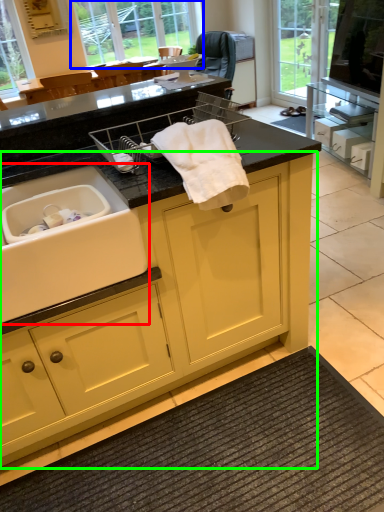
Question: Considering the real-world distances, which object is farthest from sink (highlighted by a red box)? window (highlighted by a blue box) or cabinetry (highlighted by a green box)?

Choices:
 (A) window
 (B) cabinetry

Answer: (A)